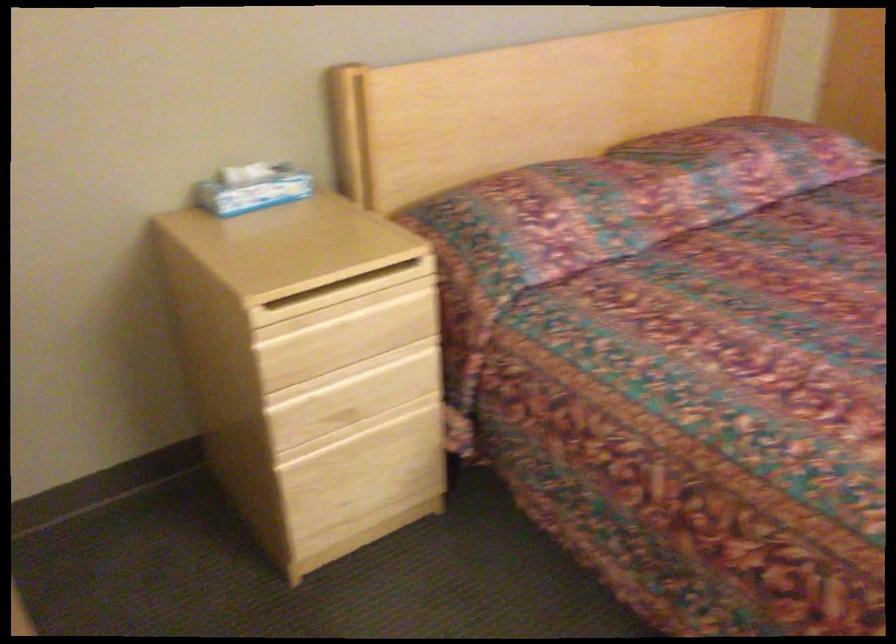
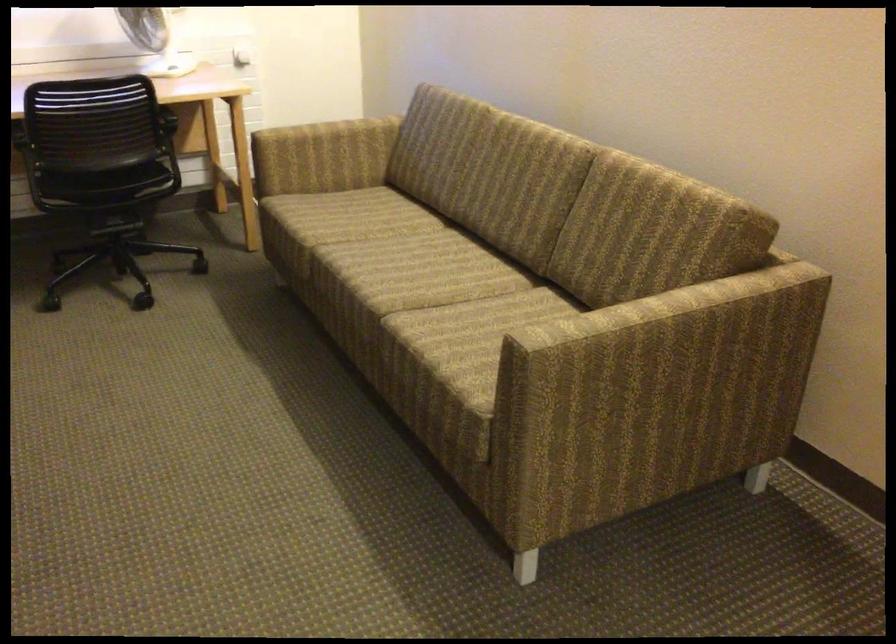
First-person continuous shooting, in which direction is the camera rotating?

The rotation direction of the camera is right-down.